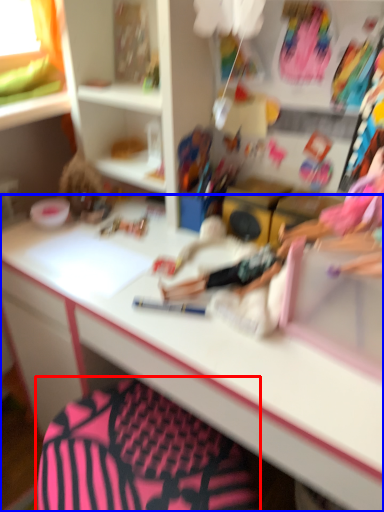
Question: Which point is closer to the camera, swivel chair (highlighted by a red box) or desk (highlighted by a blue box)?

Choices:
 (A) swivel chair
 (B) desk

Answer: (B)